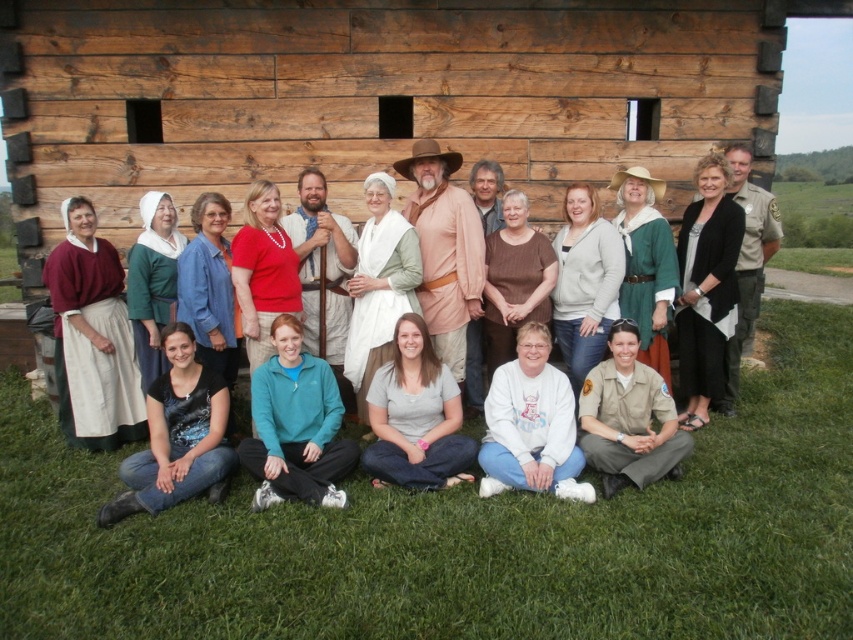
Which of these two, white cotton dress at center or matte red blouse at center, stands taller?

Standing taller between the two is white cotton dress at center.

Looking at this image, is white cotton dress at center closer to the viewer compared to matte red blouse at center?

No.

In order to click on white cotton dress at center in this screenshot , I will do pos(379,285).

Which is more to the right, teal fleece jacket at lower center or khaki uniform pants at lower right?

khaki uniform pants at lower right is more to the right.

Does teal fleece jacket at lower center appear over khaki uniform pants at lower right?

Yes, teal fleece jacket at lower center is above khaki uniform pants at lower right.

The height and width of the screenshot is (640, 853). What do you see at coordinates (296, 426) in the screenshot?
I see `teal fleece jacket at lower center` at bounding box center [296, 426].

You are a GUI agent. You are given a task and a screenshot of the screen. Output one action in this format:
    pyautogui.click(x=<x>, y=<y>)
    Task: Click on the teal fleece jacket at lower center
    This screenshot has width=853, height=640.
    Given the screenshot: What is the action you would take?
    pyautogui.click(x=296, y=426)

Looking at this image, can you confirm if white fleece sweatshirt at lower center is positioned to the right of light gray fleece jacket at center?

No, white fleece sweatshirt at lower center is not to the right of light gray fleece jacket at center.

Which is in front, point (566, 476) or point (596, 304)?

Point (566, 476) is in front.

Is point (561, 452) positioned before point (566, 332)?

Yes, it is in front of point (566, 332).

What are the coordinates of `white fleece sweatshirt at lower center` in the screenshot? It's located at (531, 424).